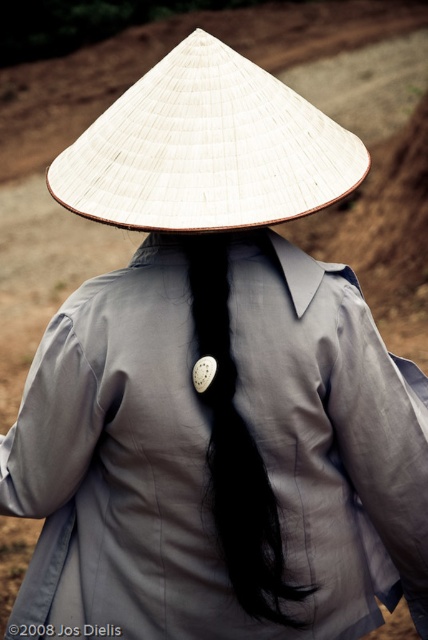
Question: Can you confirm if white woven straw hat at center is positioned to the right of black matte hair at center?

Choices:
 (A) no
 (B) yes

Answer: (A)

Question: Is the position of white woven straw hat at center less distant than that of black matte hair at center?

Choices:
 (A) yes
 (B) no

Answer: (A)

Question: Which object appears closest to the camera in this image?

Choices:
 (A) black matte hair at center
 (B) white woven straw hat at center

Answer: (B)

Question: Is white woven straw hat at center positioned behind black matte hair at center?

Choices:
 (A) yes
 (B) no

Answer: (B)